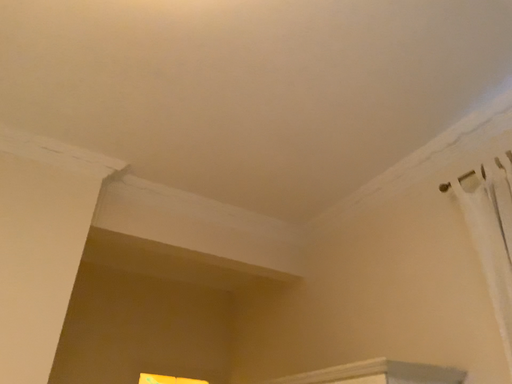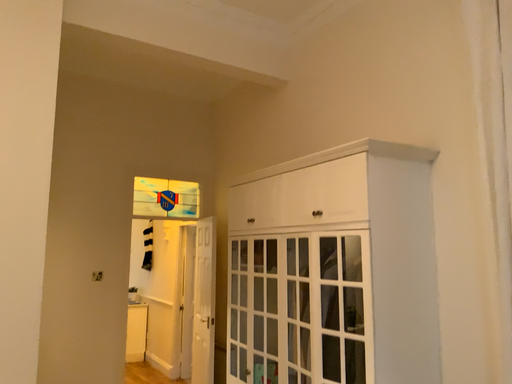
Question: How did the camera likely rotate when shooting the video?

Choices:
 (A) rotated downward
 (B) rotated upward

Answer: (A)